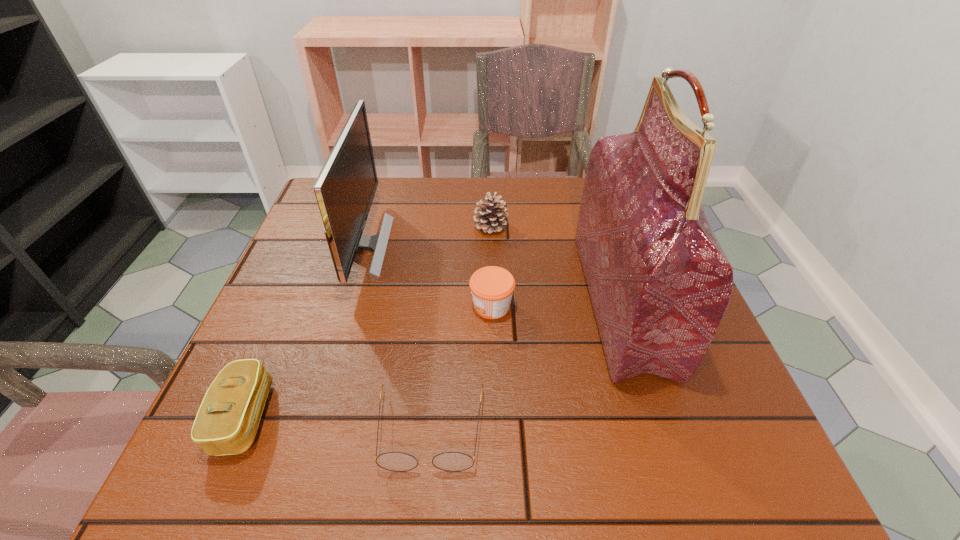
Identify the location of free space between the handbag and the spectacles. (526, 366).

Where is `free point between the clutch bag and the shortest object`? The width and height of the screenshot is (960, 540). free point between the clutch bag and the shortest object is located at coordinates (337, 423).

Locate an element on the screen. unoccupied position between the clutch bag and the spectacles is located at coordinates (337, 423).

Locate an element on the screen. The image size is (960, 540). free space between the pinecone and the fifth shortest object is located at coordinates (426, 236).

This screenshot has height=540, width=960. In order to click on free space that is in between the fifth shortest object and the leftmost object in this screenshot , I will do `click(303, 331)`.

You are a GUI agent. You are given a task and a screenshot of the screen. Output one action in this format:
    pyautogui.click(x=<x>, y=<y>)
    Task: Click on the free point between the handbag and the leftmost object
    The image size is (960, 540).
    Given the screenshot: What is the action you would take?
    pyautogui.click(x=433, y=359)

Locate an element on the screen. The width and height of the screenshot is (960, 540). unoccupied area between the jam and the spectacles is located at coordinates 461,368.

The height and width of the screenshot is (540, 960). In order to click on vacant space in between the clutch bag and the pinecone in this screenshot , I will do `click(368, 321)`.

The height and width of the screenshot is (540, 960). In order to click on free point between the pinecone and the shortest object in this screenshot , I will do `click(461, 328)`.

Locate an element on the screen. The width and height of the screenshot is (960, 540). vacant point located between the third tallest object and the leftmost object is located at coordinates (368, 321).